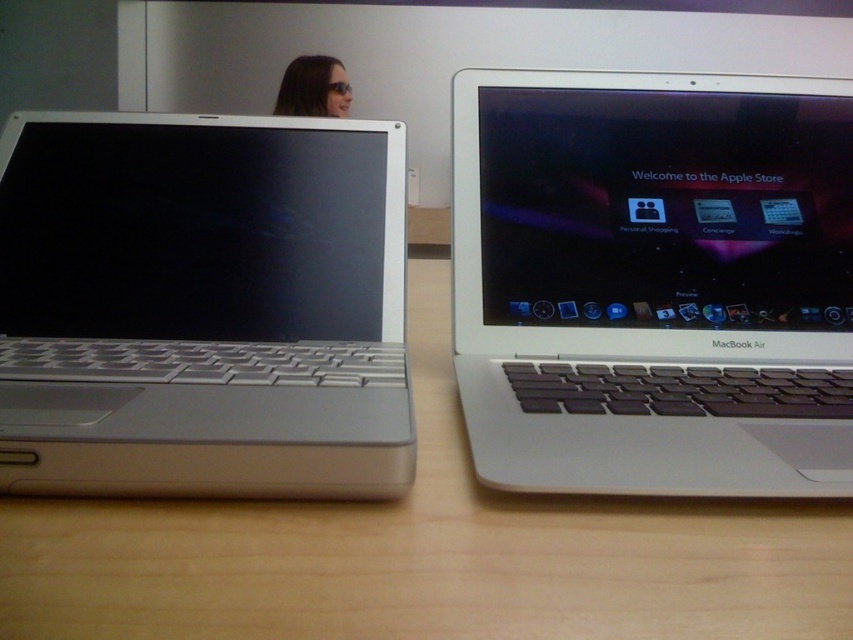
Question: Is wooden table at center closer to camera compared to matte black sunglasses at upper left?

Choices:
 (A) no
 (B) yes

Answer: (B)

Question: Considering the real-world distances, which object is farthest from the matte black sunglasses at upper left?

Choices:
 (A) wooden table at center
 (B) silver metallic laptop at left

Answer: (A)

Question: Among these objects, which one is farthest from the camera?

Choices:
 (A) matte black sunglasses at upper left
 (B) silver metallic laptop at center
 (C) silver metallic laptop at left

Answer: (A)

Question: Can you confirm if silver metallic laptop at center is thinner than matte black sunglasses at upper left?

Choices:
 (A) yes
 (B) no

Answer: (B)

Question: Is silver metallic laptop at left behind wooden table at center?

Choices:
 (A) no
 (B) yes

Answer: (B)

Question: Among these points, which one is farthest from the camera?

Choices:
 (A) (178, 445)
 (B) (321, 108)
 (C) (51, 536)
 (D) (790, 408)

Answer: (B)